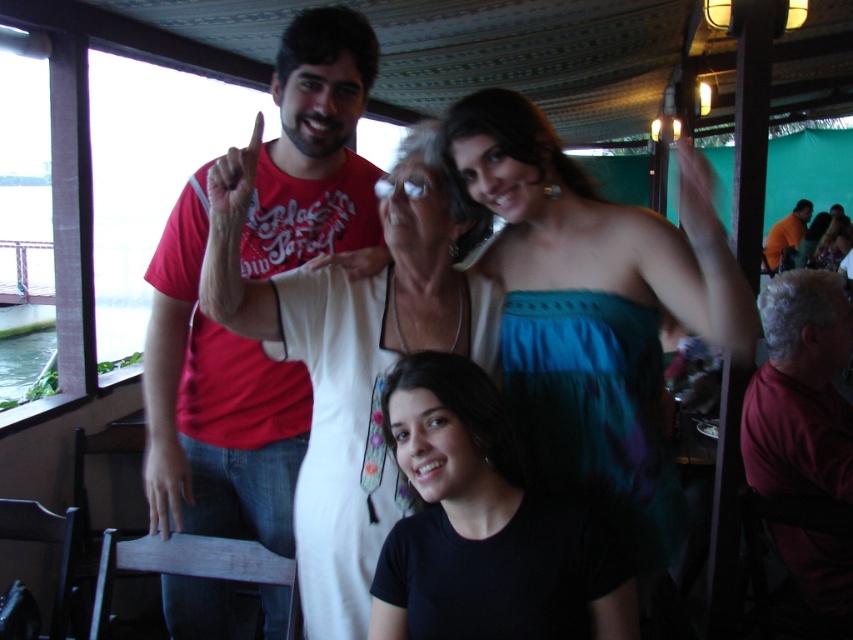
Is point (387, 497) positioned before point (395, 374)?

No, (387, 497) is behind (395, 374).

Between point (216, 243) and point (480, 632), which one is positioned in front?

Point (480, 632) is in front.

Where is `white fabric dress at center`? Image resolution: width=853 pixels, height=640 pixels. white fabric dress at center is located at coordinates (354, 356).

Based on the photo, is black matte shirt at center above orange fabric shirt at upper right?

No.

Is black matte shirt at center in front of orange fabric shirt at upper right?

Yes, it is.

What do you see at coordinates (485, 525) in the screenshot?
I see `black matte shirt at center` at bounding box center [485, 525].

Locate an element on the screen. The height and width of the screenshot is (640, 853). black matte shirt at center is located at coordinates (485, 525).

Between teal fabric dress at upper center and matte red t-shirt at upper left, which one has less height?

With less height is teal fabric dress at upper center.

Does teal fabric dress at upper center appear under matte red t-shirt at upper left?

Incorrect, teal fabric dress at upper center is not positioned below matte red t-shirt at upper left.

Who is more distant from viewer, (645, 234) or (325, 232)?

Point (325, 232)

The height and width of the screenshot is (640, 853). What are the coordinates of `teal fabric dress at upper center` in the screenshot? It's located at (595, 308).